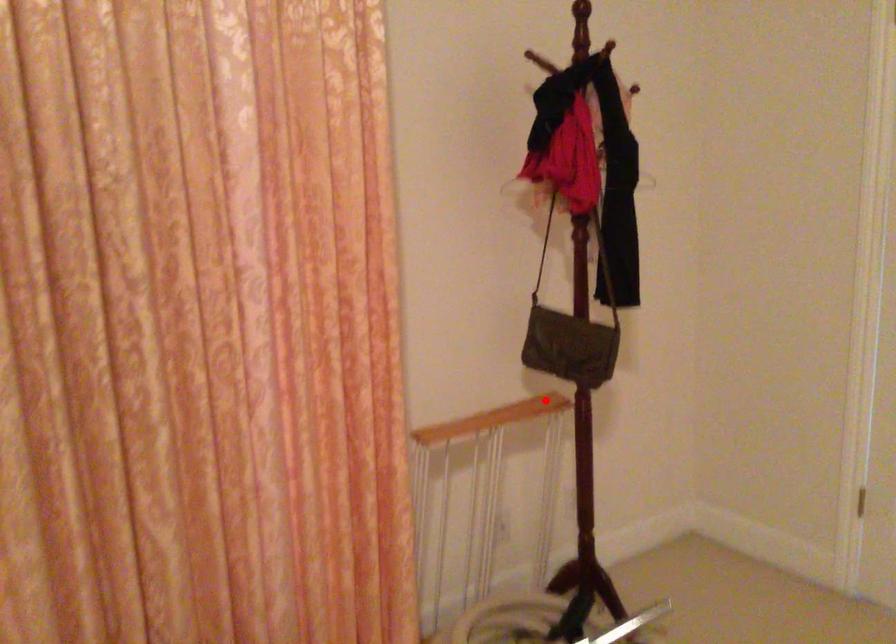
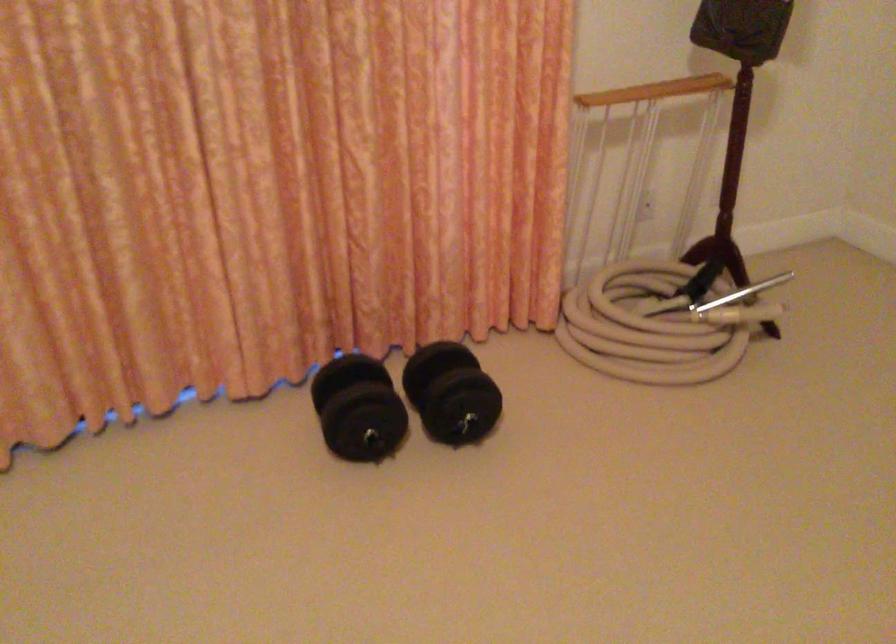
In the second image, find the point that corresponds to the highlighted location in the first image.

(711, 78)